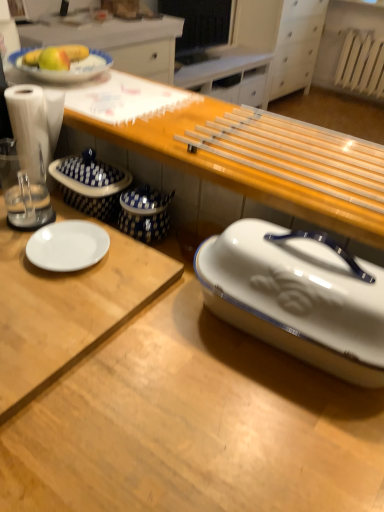
At what (x,y) coordinates should I click in order to perform the action: click on free space above white glossy plate at left, the 1th desk positioned from the top (from a real-world perspective). Please return your answer as a coordinate pair (x, y). Image resolution: width=384 pixels, height=512 pixels. Looking at the image, I should click on (54, 265).